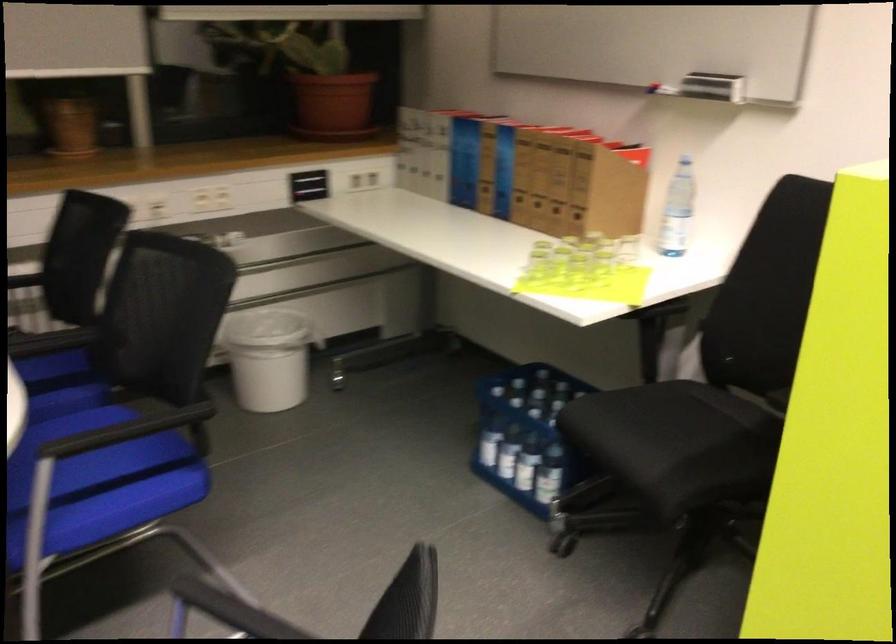
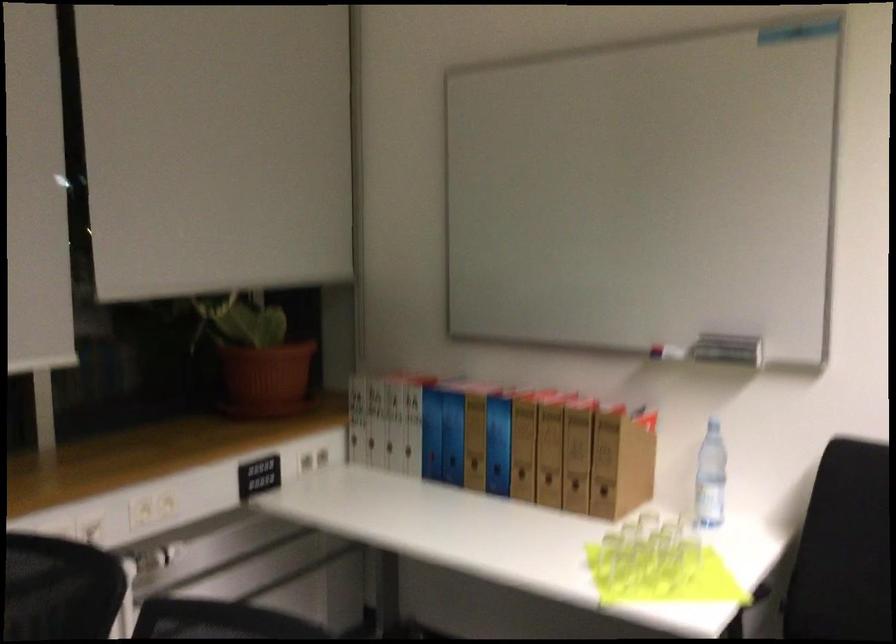
Consider the image. The images are taken continuously from a first-person perspective. In which direction are you moving?

The cameraman walked toward left, forward.